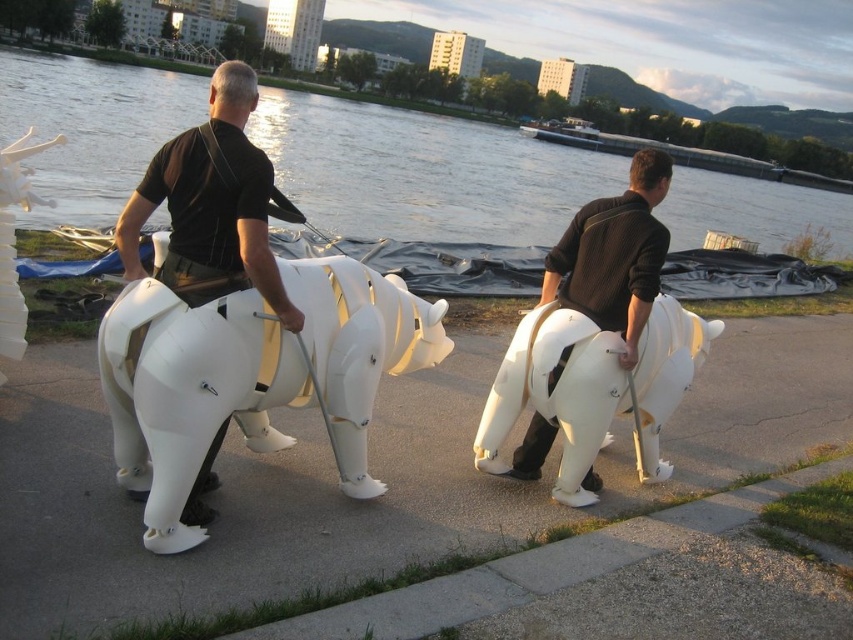
You are a visitor at an art exhibit and see the white matte mechanical horse at center and the matte white robot at center. Which one is bigger?

The white matte mechanical horse at center is bigger than the matte white robot at center.

You are standing at point (126, 349) and want to move towards point (277, 472). Considering the path between them, will you be moving closer to or farther from the camera?

You will be moving farther from the camera because point (277, 472) is further to the camera than point (126, 349).

You are an art curator planning to display the white plastic bear at center and the white matte plastic sculpture at center in a new exhibition. Based on their sizes, which one should be placed on the taller pedestal to ensure proper visibility?

The white matte plastic sculpture at center should be placed on the taller pedestal since it is taller than the white plastic bear at center, allowing it to be seen clearly from below.